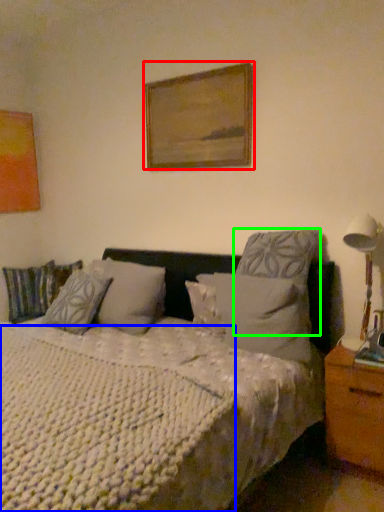
Question: Which is nearer to the picture frame (highlighted by a red box)? mattress (highlighted by a blue box) or pillow (highlighted by a green box).

Choices:
 (A) mattress
 (B) pillow

Answer: (B)